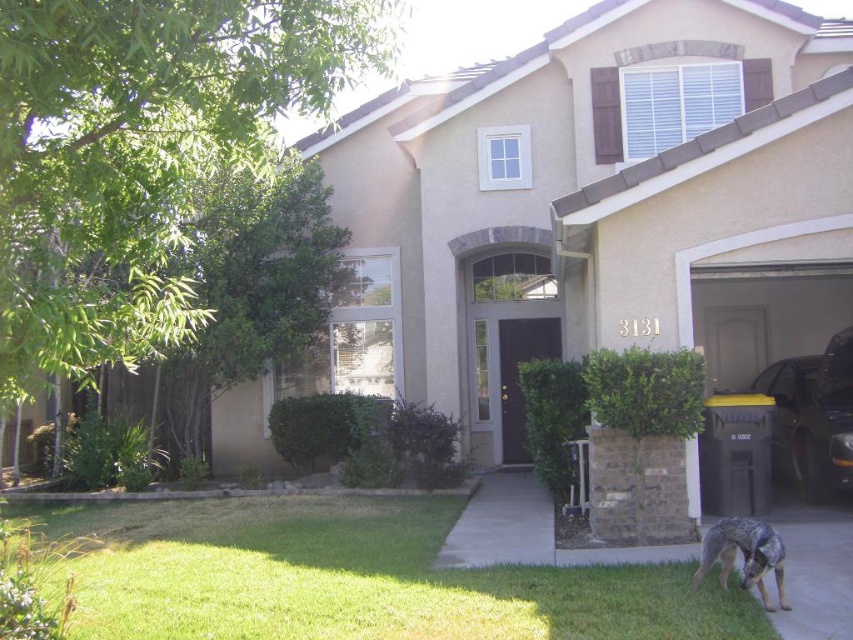
Does green grass at lower left come in front of metallic dark gray car at right?

Yes.

Can you confirm if green grass at lower left is taller than metallic dark gray car at right?

No, green grass at lower left is not taller than metallic dark gray car at right.

Locate an element on the screen. Image resolution: width=853 pixels, height=640 pixels. green grass at lower left is located at coordinates (357, 579).

Does green grass at lower left appear over gray concrete driveway at center?

Indeed, green grass at lower left is positioned over gray concrete driveway at center.

Which is in front, point (642, 598) or point (492, 477)?

Point (642, 598) is in front.

Who is more forward, (740, 600) or (525, 513)?

Point (740, 600)

You are a GUI agent. You are given a task and a screenshot of the screen. Output one action in this format:
    pyautogui.click(x=<x>, y=<y>)
    Task: Click on the green grass at lower left
    This screenshot has height=640, width=853.
    Given the screenshot: What is the action you would take?
    pyautogui.click(x=357, y=579)

Is point (558, 486) more distant than point (759, 586)?

Yes, it is.

Between point (556, 401) and point (728, 516), which one is positioned behind?

Point (556, 401)

This screenshot has width=853, height=640. Identify the location of green leafy hedge at center. (553, 419).